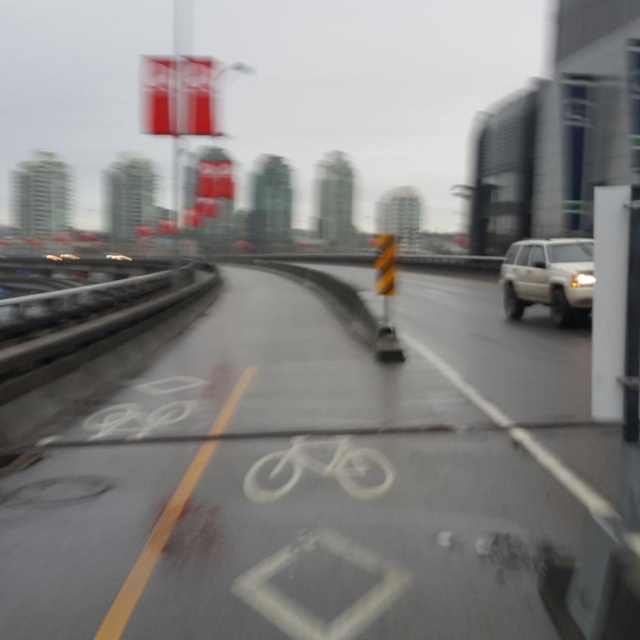
Question: Which point is closer to the camera taking this photo?

Choices:
 (A) (266, 538)
 (B) (579, 253)
 (C) (378, 496)
 (D) (396, 259)

Answer: (A)

Question: Which point is closer to the camera taking this photo?

Choices:
 (A) (410, 616)
 (B) (342, 444)
 (C) (586, 291)
 (D) (387, 272)

Answer: (A)

Question: Does white painted bicycle lane at center lie in front of yellow striped traffic cone at center?

Choices:
 (A) no
 (B) yes

Answer: (B)

Question: Which point is closer to the camera taking this photo?

Choices:
 (A) (298, 445)
 (B) (380, 266)
 (C) (348, 592)
 (D) (515, 291)

Answer: (C)

Question: Where is white painted bicycle lane at center located in relation to yellow striped traffic cone at center in the image?

Choices:
 (A) above
 (B) below

Answer: (B)

Question: Is white painted bicycle lane at center smaller than beige matte suv at right?

Choices:
 (A) yes
 (B) no

Answer: (A)